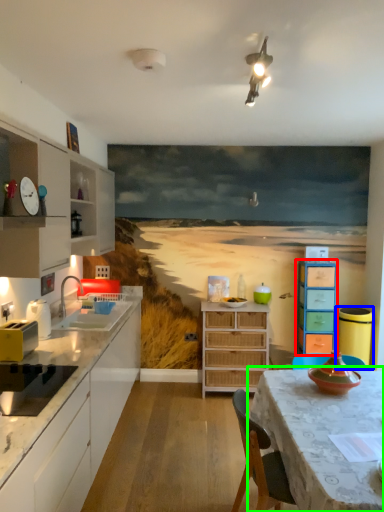
Question: Based on their relative distances, which object is farther from chest of drawers (highlighted by a red box)? Choose from appliance (highlighted by a blue box) and table (highlighted by a green box).

Choices:
 (A) appliance
 (B) table

Answer: (B)